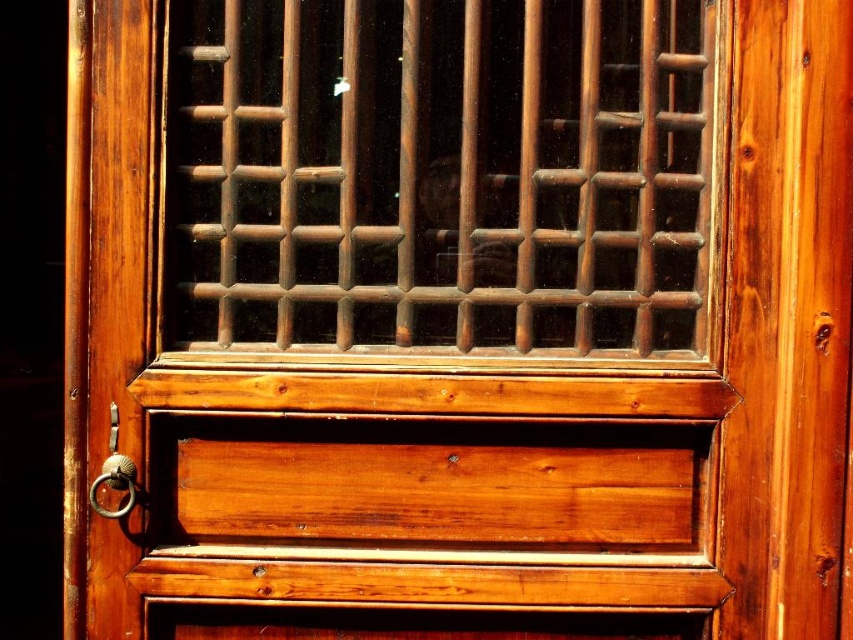
Question: Which point is farther to the camera?

Choices:
 (A) brown wooden grid at center
 (B) polished brass ring at left

Answer: (A)

Question: Observing the image, what is the correct spatial positioning of brown wooden grid at center in reference to polished brass ring at left?

Choices:
 (A) right
 (B) left

Answer: (A)

Question: Does brown wooden grid at center appear over polished brass ring at left?

Choices:
 (A) no
 (B) yes

Answer: (B)

Question: Does brown wooden grid at center have a smaller size compared to polished brass ring at left?

Choices:
 (A) yes
 (B) no

Answer: (B)

Question: Which point appears closest to the camera in this image?

Choices:
 (A) (97, 476)
 (B) (230, 296)

Answer: (A)